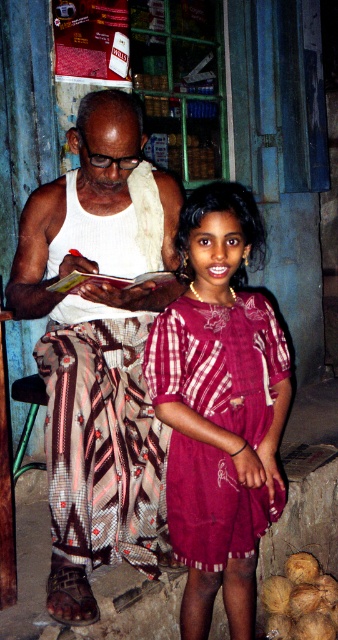
Question: Which is farther from the maroon woven dress at center?

Choices:
 (A) brown rough coconut at lower right
 (B) white textured tank top at center

Answer: (A)

Question: Can you confirm if white textured tank top at center is smaller than maroon woven dress at center?

Choices:
 (A) yes
 (B) no

Answer: (B)

Question: Based on their relative distances, which object is farther from the white textured tank top at center?

Choices:
 (A) maroon woven dress at center
 (B) brown rough coconut at lower right

Answer: (B)

Question: Does white textured tank top at center appear over maroon woven dress at center?

Choices:
 (A) yes
 (B) no

Answer: (A)

Question: Which object is closer to the camera taking this photo?

Choices:
 (A) white textured tank top at center
 (B) brown rough coconut at lower right
 (C) maroon woven dress at center

Answer: (C)

Question: Can you confirm if maroon woven dress at center is positioned below brown rough coconut at lower right?

Choices:
 (A) no
 (B) yes

Answer: (A)